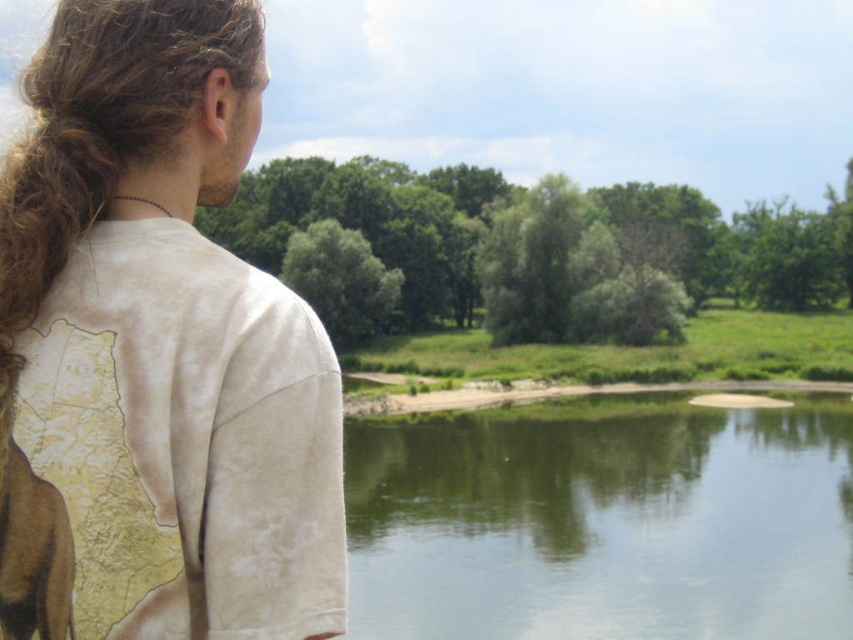
You are a photographer trying to capture the person in the image. The person is standing at point (155,352), which is the white cotton shirt at left. Where should you position yourself to ensure the person is centered in your shot?

The point (155,352) corresponds to the white cotton shirt at left, so you should position yourself to the right of the white cotton shirt at left to center the person in your shot.

You are a photographer trying to capture the scene with the white cotton shirt at left. Where should you position yourself to ensure the shirt is in the frame?

The white cotton shirt at left is located at point (155, 352), so you should position yourself to the left side of the scene to include the shirt in your frame.

You are a photographer aiming to capture the reflection of the white cotton shirt at left in the green smooth water at center. Based on their positions, is this reflection likely visible in the water?

The white cotton shirt at left is closer to the viewer than the green smooth water at center, so its reflection would not be visible in the water since the shirt is in front of the water.